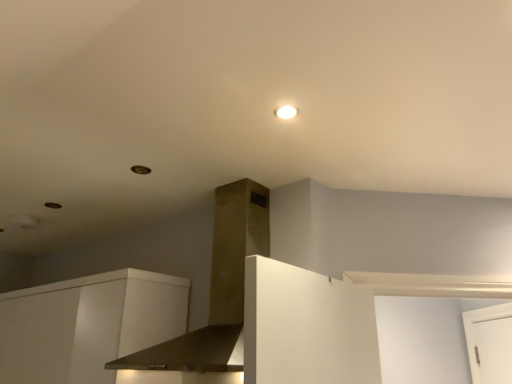
Question: Does satin gold vent at center come behind white glossy light fixture at upper center?

Choices:
 (A) yes
 (B) no

Answer: (B)

Question: Is satin gold vent at center positioned beyond the bounds of white glossy light fixture at upper center?

Choices:
 (A) yes
 (B) no

Answer: (A)

Question: From the image's perspective, is satin gold vent at center on white glossy light fixture at upper center?

Choices:
 (A) no
 (B) yes

Answer: (A)

Question: From the image's perspective, does satin gold vent at center appear lower than white glossy light fixture at upper center?

Choices:
 (A) yes
 (B) no

Answer: (A)

Question: Would you say white glossy light fixture at upper center is part of satin gold vent at center's contents?

Choices:
 (A) yes
 (B) no

Answer: (B)

Question: Does satin gold vent at center have a lesser width compared to white glossy light fixture at upper center?

Choices:
 (A) no
 (B) yes

Answer: (A)

Question: From a real-world perspective, is white matte cabinet at lower left located beneath white glossy light fixture at upper center?

Choices:
 (A) yes
 (B) no

Answer: (A)

Question: From the image's perspective, is white matte cabinet at lower left above white glossy light fixture at upper center?

Choices:
 (A) yes
 (B) no

Answer: (B)

Question: Considering the relative sizes of white matte cabinet at lower left and white glossy light fixture at upper center in the image provided, is white matte cabinet at lower left taller than white glossy light fixture at upper center?

Choices:
 (A) yes
 (B) no

Answer: (A)

Question: Is white matte cabinet at lower left placed right next to white glossy light fixture at upper center?

Choices:
 (A) yes
 (B) no

Answer: (B)

Question: Does white matte cabinet at lower left turn towards white glossy light fixture at upper center?

Choices:
 (A) no
 (B) yes

Answer: (A)

Question: Can you confirm if white matte cabinet at lower left is bigger than white glossy light fixture at upper center?

Choices:
 (A) no
 (B) yes

Answer: (B)

Question: From a real-world perspective, is satin gold vent at center located higher than white matte cabinet at lower left?

Choices:
 (A) yes
 (B) no

Answer: (A)